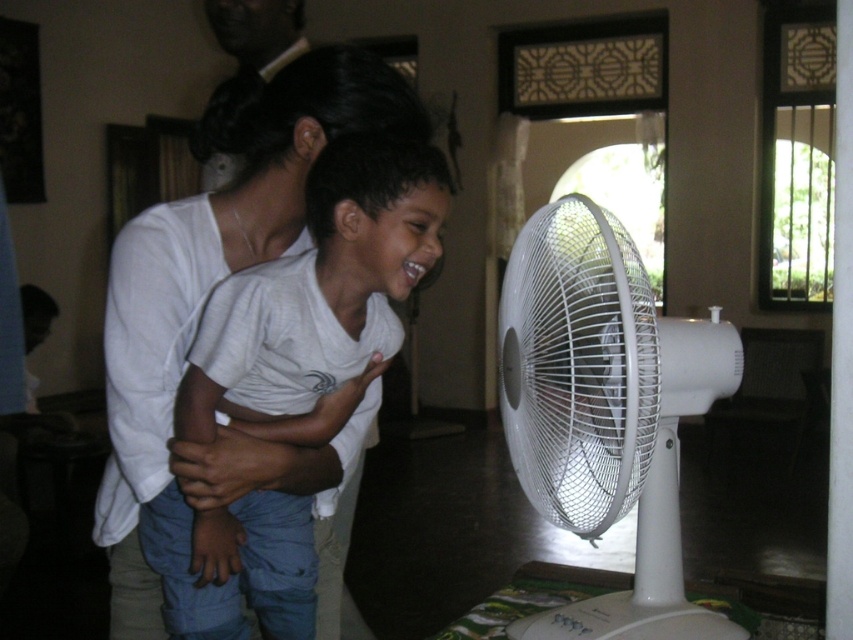
Question: Where is white plastic mechanical fan at center located in relation to black hair at upper center in the image?

Choices:
 (A) left
 (B) right

Answer: (B)

Question: Which of the following is the closest to the observer?

Choices:
 (A) black hair at upper center
 (B) white cotton shirt at center
 (C) white plastic mechanical fan at center

Answer: (C)

Question: In this image, where is white plastic mechanical fan at center located relative to white cotton shirt at center?

Choices:
 (A) right
 (B) left

Answer: (A)

Question: Considering the real-world distances, which object is closest to the white plastic mechanical fan at center?

Choices:
 (A) white cotton shirt at center
 (B) black hair at upper center

Answer: (A)

Question: In this image, where is white cotton shirt at center located relative to black hair at upper center?

Choices:
 (A) above
 (B) below

Answer: (B)

Question: Which object appears closest to the camera in this image?

Choices:
 (A) black hair at upper center
 (B) white plastic mechanical fan at center

Answer: (B)